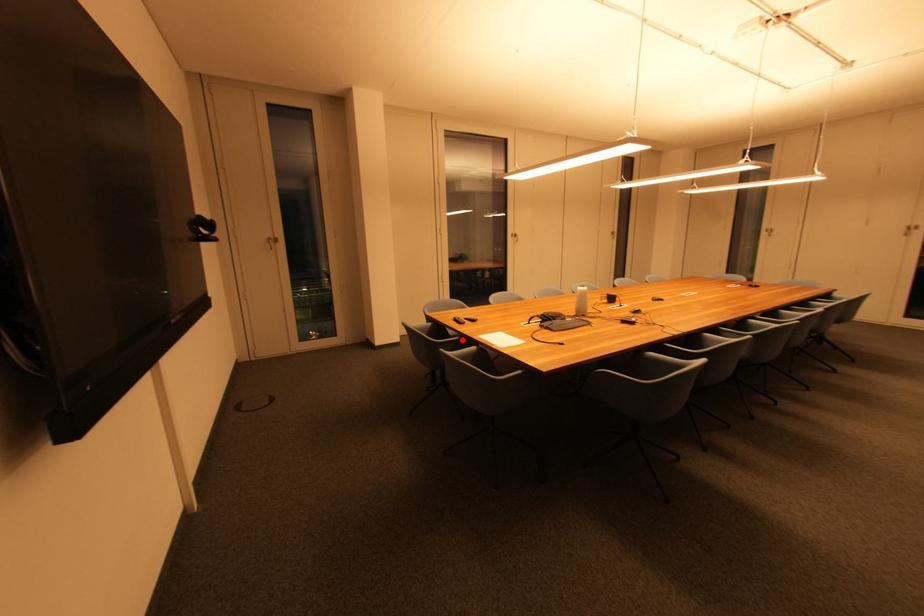
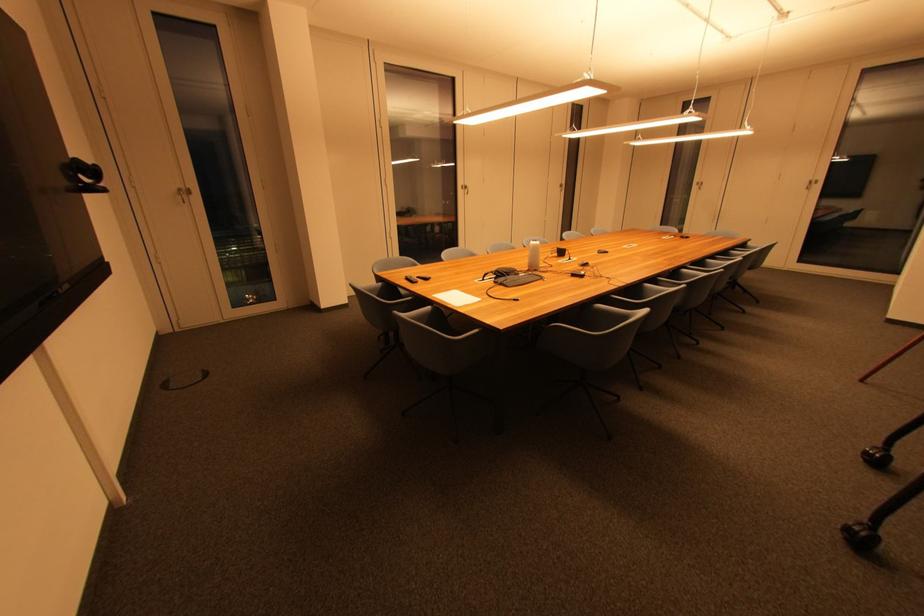
In the second image, find the point that corresponds to the highlighted location in the first image.

(416, 300)